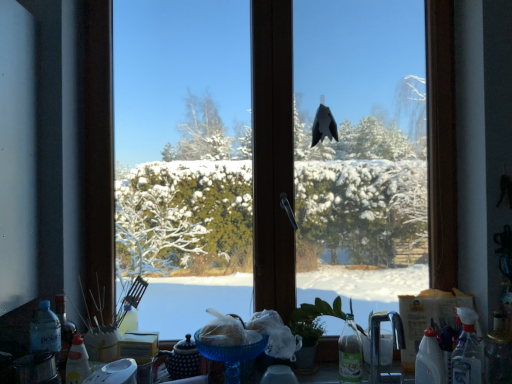
Question: In terms of height, does translucent plastic bottle at lower left, which is the first bottle in left-to-right order, look taller or shorter compared to transparent glass window at center?

Choices:
 (A) tall
 (B) short

Answer: (B)

Question: From a real-world perspective, is translucent plastic bottle at lower left, which is the first bottle in left-to-right order, physically located above or below transparent glass window at center?

Choices:
 (A) above
 (B) below

Answer: (B)

Question: Estimate the real-world distances between objects in this image. Which object is closer to the transparent glass window at center?

Choices:
 (A) transparent plastic spray bottle at lower right, which is the fourth bottle from left to right
 (B) translucent plastic bottle at lower right, placed as the 1th bottle when sorted from right to left
 (C) satin nickel faucet at lower right
 (D) translucent plastic bottle at lower left, the fifth bottle positioned from the right
 (E) clear plastic bottle at lower right, arranged as the third bottle when viewed from the left

Answer: (C)

Question: Which object is positioned closest to the clear plastic bottle at lower right, arranged as the third bottle when viewed from the left?

Choices:
 (A) translucent plastic bottle at lower right, placed as the 1th bottle when sorted from right to left
 (B) transparent glass window at center
 (C) transparent plastic spray bottle at lower right, which is the fourth bottle from left to right
 (D) satin nickel faucet at lower right
 (E) translucent plastic bottle at lower left, which is counted as the second bottle, starting from the left

Answer: (C)